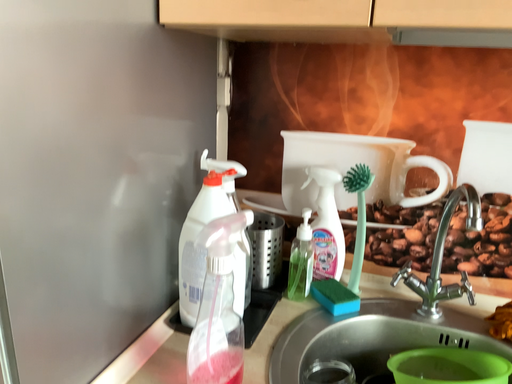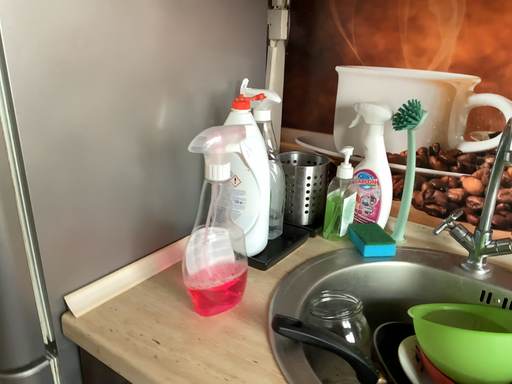
Question: How did the camera likely rotate when shooting the video?

Choices:
 (A) rotated right
 (B) rotated left

Answer: (B)